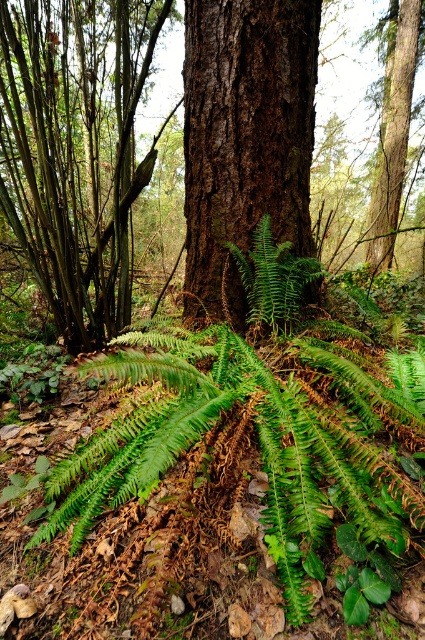
Who is more forward, (229, 301) or (280, 256)?

Point (280, 256) is in front.

Consider the image. Is dark brown bark tree trunk at center to the right of green matte fern at center from the viewer's perspective?

Incorrect, dark brown bark tree trunk at center is not on the right side of green matte fern at center.

Find the location of a particular element. dark brown bark tree trunk at center is located at coordinates (244, 138).

At what (x,y) coordinates should I click in order to perform the action: click on dark brown bark tree trunk at center. Please return your answer as a coordinate pair (x, y). The image size is (425, 640). Looking at the image, I should click on (244, 138).

I want to click on smooth brown tree trunk at center, so click(393, 131).

Is smooth brown tree trunk at center further to the viewer compared to green matte fern at center?

That is True.

Between point (391, 65) and point (252, 275), which one is positioned behind?

The point (391, 65) is more distant.

Find the location of a particular element. This screenshot has height=640, width=425. smooth brown tree trunk at center is located at coordinates (393, 131).

Is brown rough bark tree at center positioned before dark brown bark tree trunk at center?

No, brown rough bark tree at center is further to the viewer.

Who is positioned more to the right, brown rough bark tree at center or dark brown bark tree trunk at center?

A: dark brown bark tree trunk at center is more to the right.

Is point (39, 253) closer to viewer compared to point (215, 88)?

No, (39, 253) is behind (215, 88).

You are a GUI agent. You are given a task and a screenshot of the screen. Output one action in this format:
    pyautogui.click(x=<x>, y=<y>)
    Task: Click on the brown rough bark tree at center
    
    Given the screenshot: What is the action you would take?
    pyautogui.click(x=76, y=150)